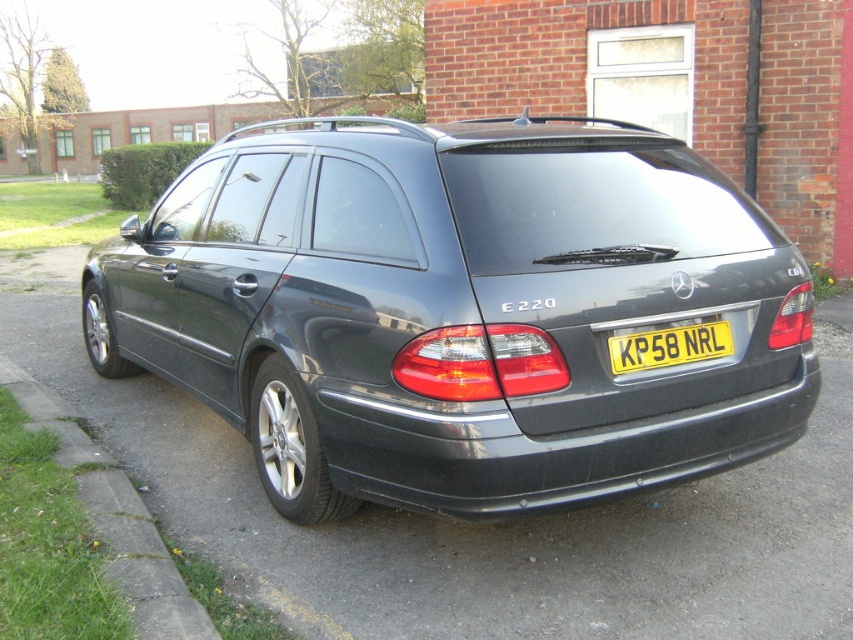
Question: Does satin black station wagon at center have a smaller size compared to yellow metallic license plate at center?

Choices:
 (A) no
 (B) yes

Answer: (A)

Question: Does green grass at lower left have a lesser width compared to yellow metallic license plate at center?

Choices:
 (A) no
 (B) yes

Answer: (A)

Question: Estimate the real-world distances between objects in this image. Which object is farther from the satin black station wagon at center?

Choices:
 (A) yellow metallic license plate at center
 (B) green grass at lower left

Answer: (B)

Question: Which object appears farthest from the camera in this image?

Choices:
 (A) yellow metallic license plate at center
 (B) satin black station wagon at center
 (C) green grass at lower left

Answer: (B)

Question: Which point appears farthest from the camera in this image?

Choices:
 (A) (148, 289)
 (B) (693, 346)

Answer: (A)

Question: Is satin black station wagon at center wider than yellow metallic license plate at center?

Choices:
 (A) no
 (B) yes

Answer: (A)